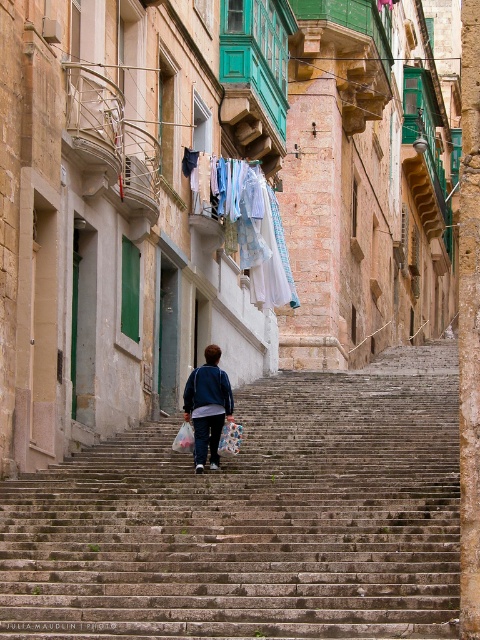
You are a photographer standing on the street and want to take a photo of the person in the blue fleece jacket at center and the plastic bag at center. Which object should you zoom in on to capture both in the frame without cropping?

The blue fleece jacket at center is larger in size than the plastic bag at center, so you should zoom in on the blue fleece jacket at center to ensure both objects fit in the frame.

You are a photographer standing on the street and want to take a picture of the person in the blue fleece jacket at center and the plastic bag at center. Based on their positions, which object will appear larger in the photo?

The blue fleece jacket at center will appear larger in the photo since it is positioned over the plastic bag at center, indicating it is closer to the camera.

You are a tourist trying to find the entrance to the historic building. You see the stone stairs at center and the light blue fabric at upper center. Which object is located to the right of the other?

The stone stairs at center is positioned on the right side of light blue fabric at upper center, so the stone stairs at center is to the right of the light blue fabric at upper center.